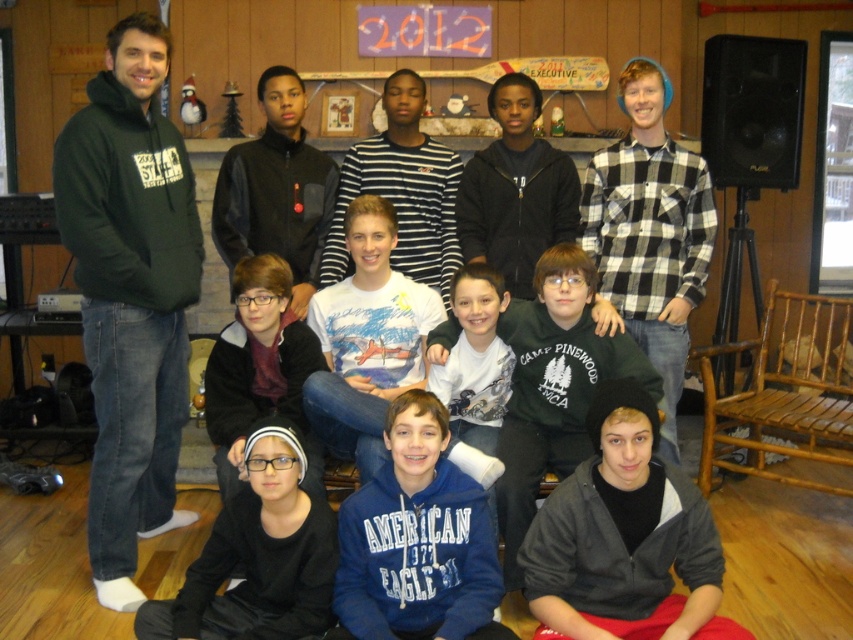
You are a photographer trying to adjust the spacing between the blue fleece sweatshirt at lower center and the green fleece sweatshirt at center for a better composition. The camera requires at least 18 inches between subjects for optimal focus. Can the current spacing accommodate this requirement?

The distance between the blue fleece sweatshirt at lower center and the green fleece sweatshirt at center is 18.43 inches, which is just over the required 18 inches. Therefore, the current spacing can accommodate the camera requirement for optimal focus.

You are standing at point (254, 636) and want to take a photo of the group. The camera you have requires you to be at least 8 feet away to capture everyone in the frame. Can you take the photo from your current position?

The distance between point (254, 636) and the camera is 7.86 feet, which is slightly less than the required 8 feet. Therefore, you cannot take the photo from your current position as you are too close to capture everyone in the frame.